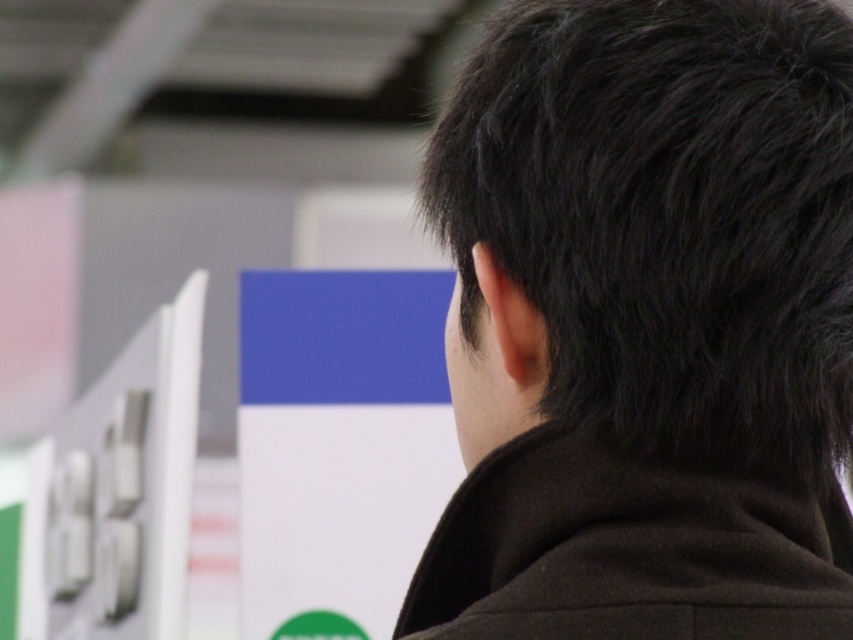
Who is shorter, black matte hair at upper right or black matte jacket at center?

black matte jacket at center is shorter.

From the picture: How distant is black matte hair at upper right from black matte jacket at center?

black matte hair at upper right and black matte jacket at center are 5.89 centimeters apart from each other.

Which is in front, point (619, 376) or point (415, 609)?

Point (619, 376)

Locate an element on the screen. The height and width of the screenshot is (640, 853). black matte hair at upper right is located at coordinates (646, 324).